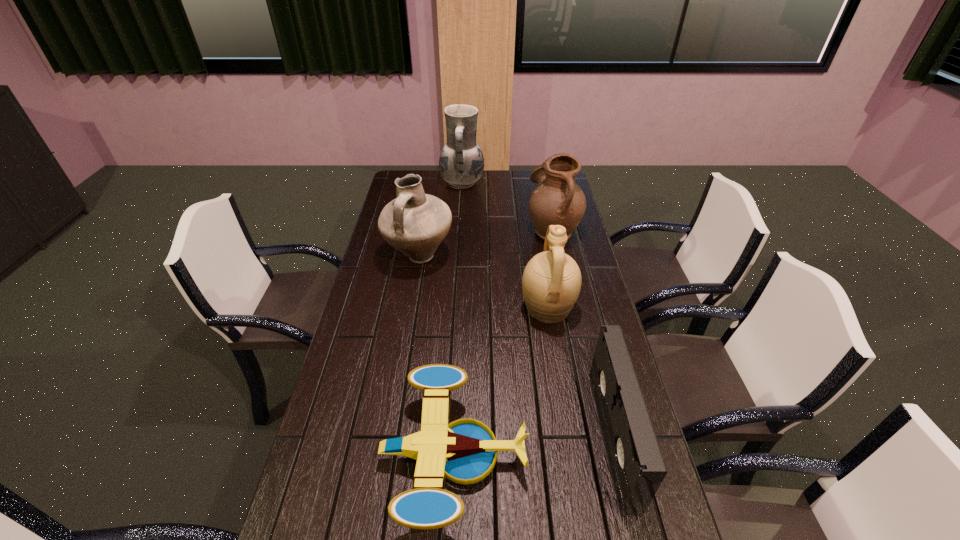
I want to click on the farthest pitcher, so click(x=461, y=163).

In order to click on the nearest pitcher in this screenshot , I will do (551, 282).

At what (x,y) coordinates should I click in order to perform the action: click on the fifth tallest object. Please return your answer as a coordinate pair (x, y). Image resolution: width=960 pixels, height=540 pixels. Looking at the image, I should click on (637, 467).

This screenshot has width=960, height=540. I want to click on free space located on the front-facing side of the farthest pitcher, so click(509, 183).

At what (x,y) coordinates should I click in order to perform the action: click on free space located 0.060m on the right of the nearest pitcher. Please return your answer as a coordinate pair (x, y). This screenshot has width=960, height=540. Looking at the image, I should click on (593, 308).

This screenshot has height=540, width=960. I want to click on vacant space located 0.370m on the side of the fifth tallest object with visible spindles, so click(458, 437).

Identify the location of vacant space located 0.110m on the side of the fifth tallest object with visible spindles. The image size is (960, 540). (560, 437).

This screenshot has width=960, height=540. I want to click on free spot located on the side of the fifth tallest object with visible spindles, so click(478, 437).

The height and width of the screenshot is (540, 960). I want to click on object that is at the far edge, so click(461, 163).

Find the location of a particular element. The width and height of the screenshot is (960, 540). object positioned at the left edge is located at coordinates (415, 223).